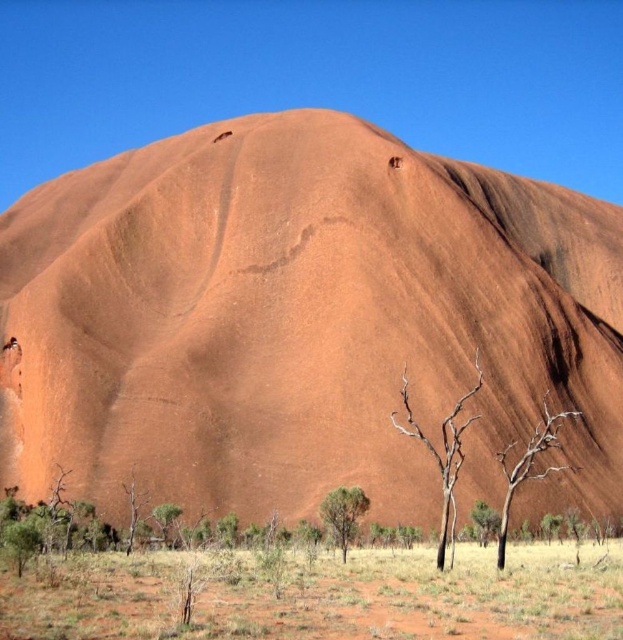
Question: Considering the relative positions of matte sandstone hill at center and green leafy shrub at lower center in the image provided, where is matte sandstone hill at center located with respect to green leafy shrub at lower center?

Choices:
 (A) above
 (B) below

Answer: (A)

Question: In this image, where is matte sandstone hill at center located relative to green leafy tree at lower center?

Choices:
 (A) above
 (B) below

Answer: (A)

Question: Which of these objects is positioned closest to the brown bark tree at lower right?

Choices:
 (A) green leafy shrub at lower left
 (B) brown bark tree at lower center
 (C) green leafy shrub at lower center

Answer: (B)

Question: Is matte sandstone hill at center below green leafy tree at lower center?

Choices:
 (A) no
 (B) yes

Answer: (A)

Question: Which point is closer to the camera?

Choices:
 (A) green leafy shrub at lower center
 (B) green leafy shrub at lower left

Answer: (B)

Question: Considering the real-world distances, which object is closest to the green leafy shrub at lower left?

Choices:
 (A) brown bark tree at lower center
 (B) green leafy tree at lower center
 (C) matte sandstone hill at center

Answer: (B)